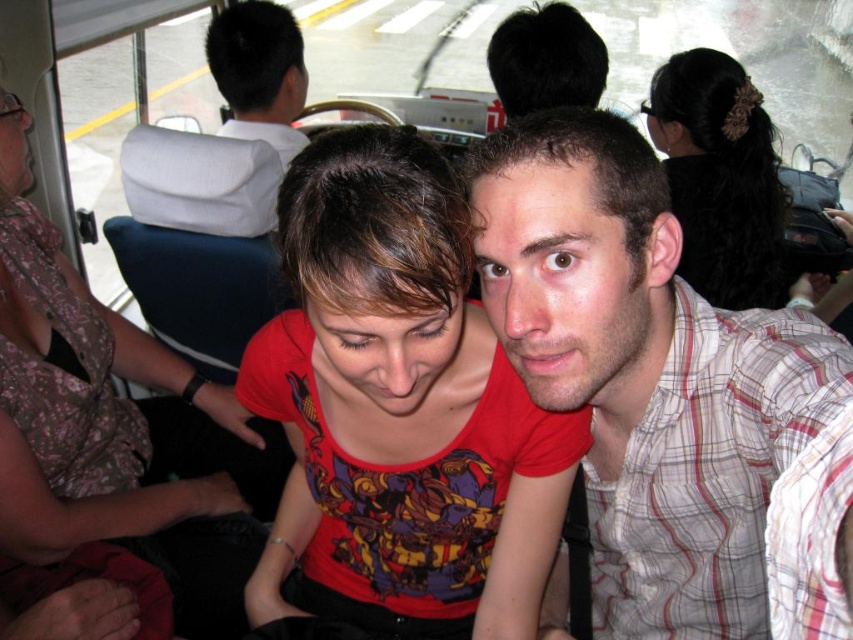
You are a photographer trying to capture a group photo of passengers on a bus. You notice the plaid cotton shirt at center and the matte red shirt at center. Since you want everyone to fit in the frame, which shirt should you adjust the camera angle to focus on to ensure both shirts are visible without cropping?

The plaid cotton shirt at center has a lesser width compared to matte red shirt at center, so you should focus on the wider matte red shirt at center to ensure both shirts are visible without cropping.